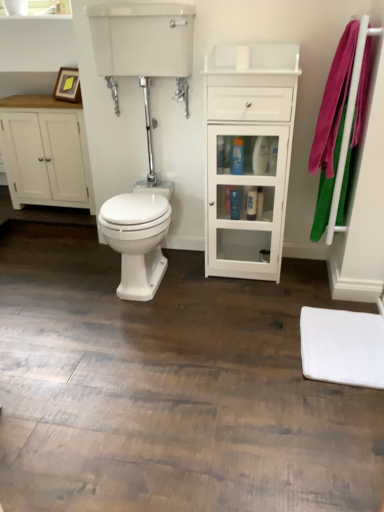
Identify the location of vacant area on top of white glossy bidet at center (from a real-world perspective). The width and height of the screenshot is (384, 512). (135, 204).